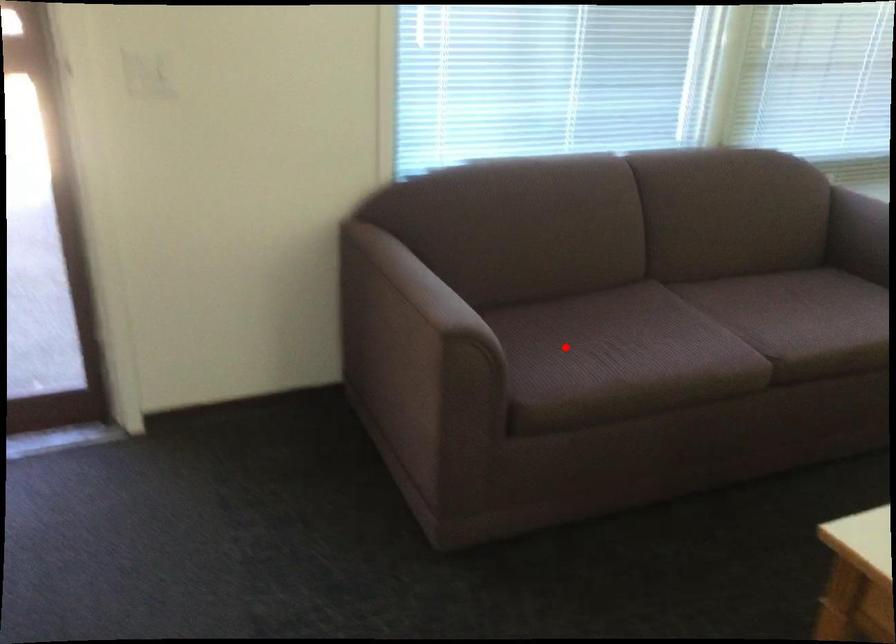
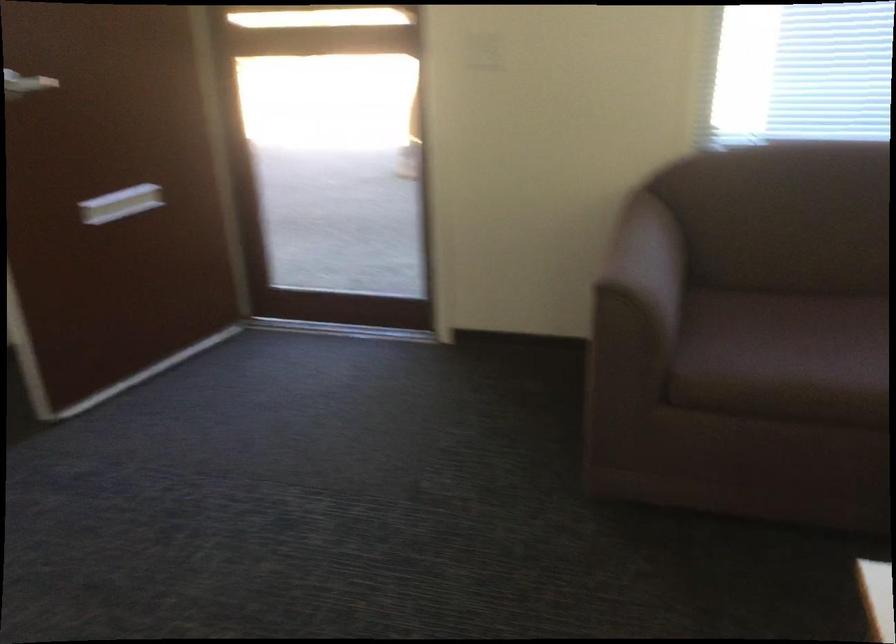
Where in the second image is the point corresponding to the highlighted location from the first image?

(786, 337)